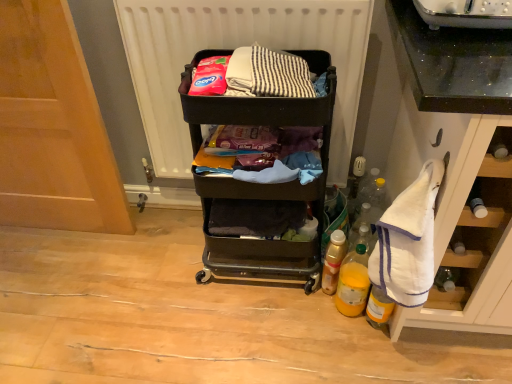
Question: From the image's perspective, is black plastic cart at center on top of white matte radiator at upper center?

Choices:
 (A) no
 (B) yes

Answer: (A)

Question: Is the depth of black plastic cart at center greater than that of white matte radiator at upper center?

Choices:
 (A) yes
 (B) no

Answer: (B)

Question: Are black plastic cart at center and white matte radiator at upper center making contact?

Choices:
 (A) no
 (B) yes

Answer: (A)

Question: Is black plastic cart at center smaller than white matte radiator at upper center?

Choices:
 (A) no
 (B) yes

Answer: (A)

Question: Would you say black plastic cart at center is outside white matte radiator at upper center?

Choices:
 (A) no
 (B) yes

Answer: (B)

Question: In terms of width, does white terry cloth towel at right look wider or thinner when compared to yellow matte bottle at lower right, arranged as the second bottle when viewed from the left?

Choices:
 (A) wide
 (B) thin

Answer: (A)

Question: Is white terry cloth towel at right taller or shorter than yellow matte bottle at lower right, arranged as the second bottle when viewed from the right?

Choices:
 (A) tall
 (B) short

Answer: (A)

Question: Is white terry cloth towel at right in front of or behind yellow matte bottle at lower right, arranged as the second bottle when viewed from the left, in the image?

Choices:
 (A) front
 (B) behind

Answer: (A)

Question: Is point (390, 205) positioned closer to the camera than point (355, 309)?

Choices:
 (A) closer
 (B) farther

Answer: (A)

Question: In terms of size, does yellow translucent bottle at lower right, the first bottle viewed from the right, appear bigger or smaller than white matte radiator at upper center?

Choices:
 (A) small
 (B) big

Answer: (A)

Question: Does point (371, 321) appear closer or farther from the camera than point (159, 13)?

Choices:
 (A) farther
 (B) closer

Answer: (A)

Question: In terms of height, does yellow translucent bottle at lower right, arranged as the 3th bottle when viewed from the left, look taller or shorter compared to white matte radiator at upper center?

Choices:
 (A) tall
 (B) short

Answer: (B)

Question: Would you say yellow translucent bottle at lower right, arranged as the 3th bottle when viewed from the left, is to the left or to the right of white matte radiator at upper center in the picture?

Choices:
 (A) left
 (B) right

Answer: (B)

Question: Considering their positions, is translucent plastic bottle at lower right, the third bottle positioned from the right, located in front of or behind white terry cloth towel at right?

Choices:
 (A) behind
 (B) front

Answer: (A)

Question: Choose the correct answer: Is translucent plastic bottle at lower right, the third bottle positioned from the right, inside white terry cloth towel at right or outside it?

Choices:
 (A) inside
 (B) outside

Answer: (B)